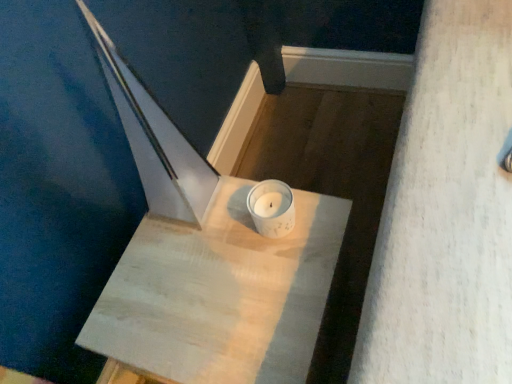
The image size is (512, 384). Identify the location of free location above white marble table at center (from a real-world perspective). (210, 284).